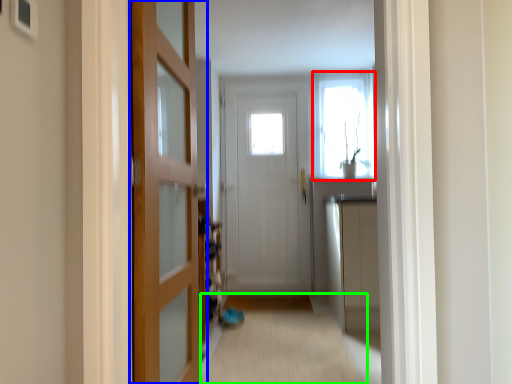
Question: Estimate the real-world distances between objects in this image. Which object is closer to window (highlighted by a red box), door (highlighted by a blue box) or alley (highlighted by a green box)?

Choices:
 (A) door
 (B) alley

Answer: (B)